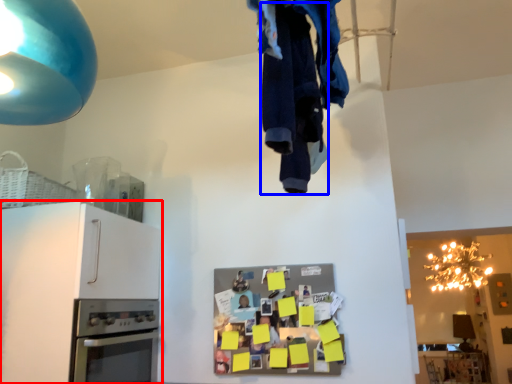
Question: Which point is further to the camera, cabinetry (highlighted by a red box) or clothing (highlighted by a blue box)?

Choices:
 (A) cabinetry
 (B) clothing

Answer: (A)